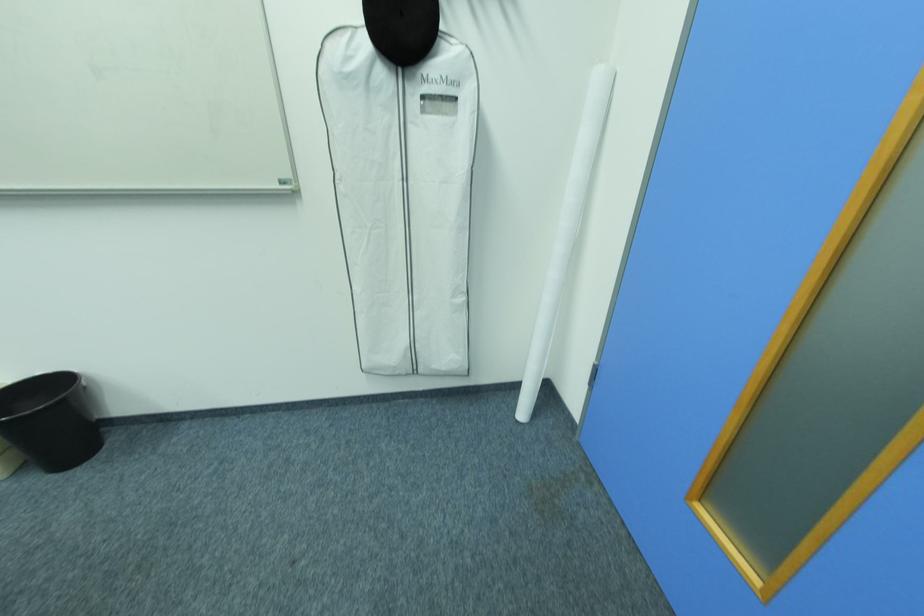
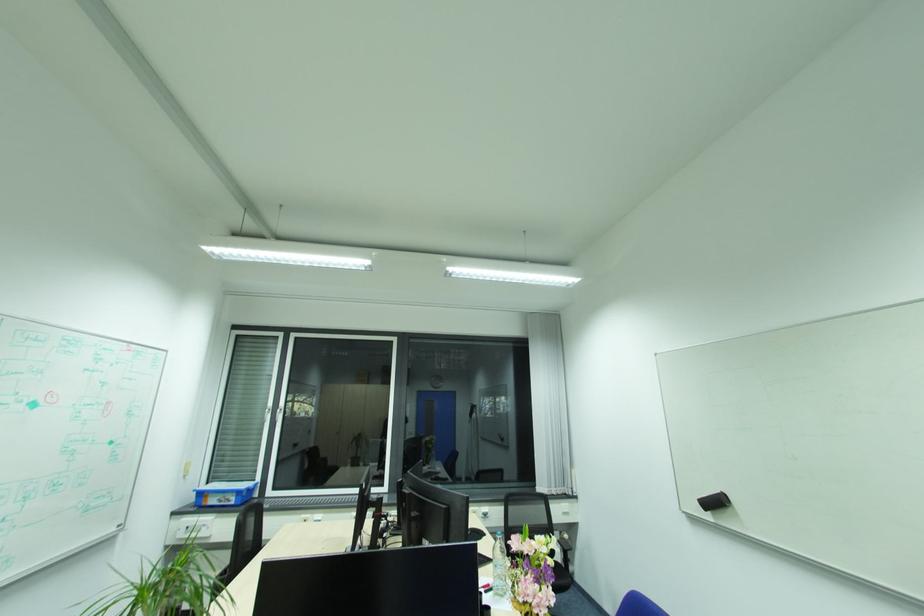
Based on the continuous images, in which direction is the camera rotating?

The camera's rotation is toward left-up.